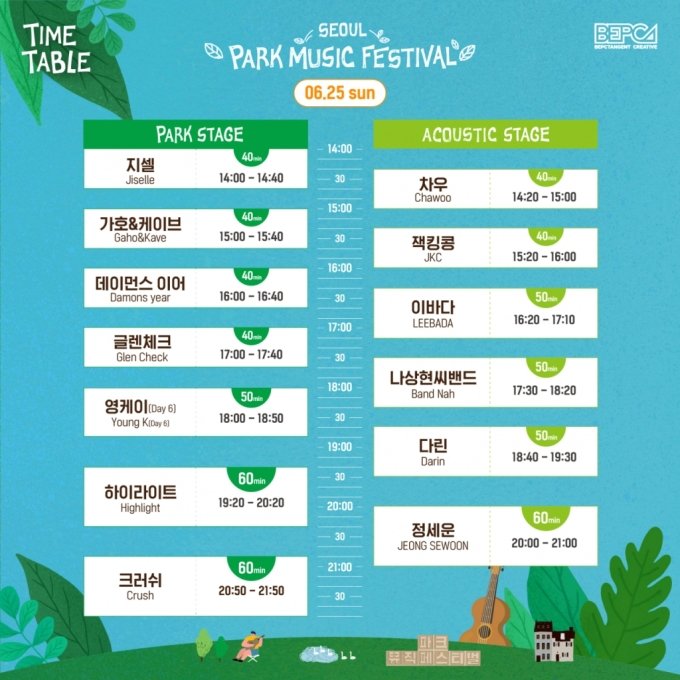
At what (x,y) coordinates should I click in order to perform the action: click on 1 guitar. Please return your answer as a coordinate pair (x, y). The image size is (680, 680). Looking at the image, I should click on (488, 613).